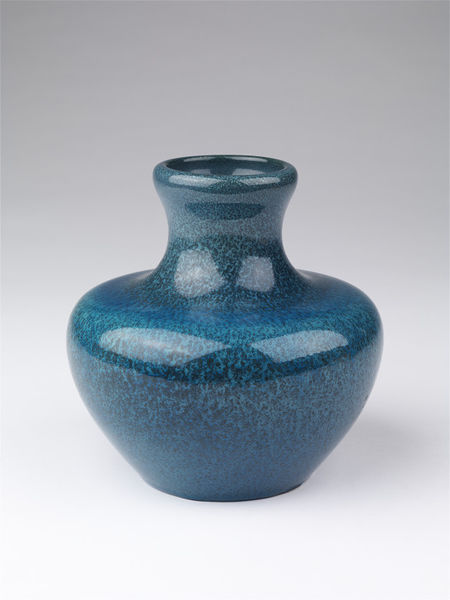
Locate an element on the screen. This screenshot has height=600, width=450. empty space above pot is located at coordinates (231, 75).